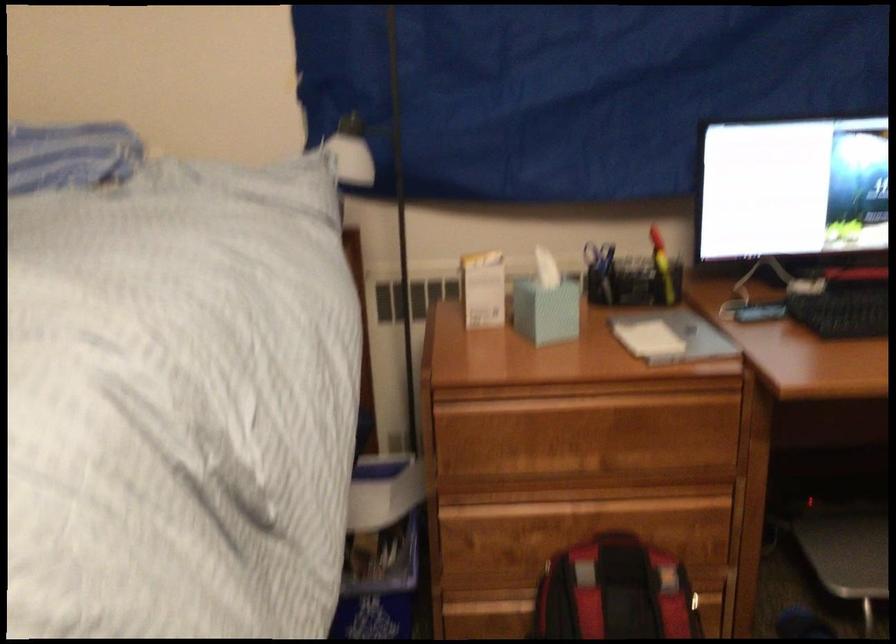
You are a GUI agent. You are given a task and a screenshot of the screen. Output one action in this format:
    pyautogui.click(x=<x>, y=<y>)
    Task: Click on the white lamp shade
    
    Given the screenshot: What is the action you would take?
    pyautogui.click(x=355, y=167)